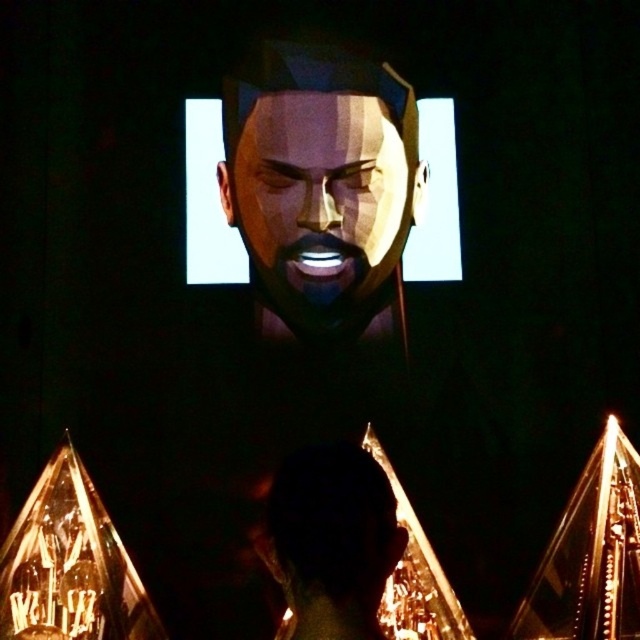
Measure the distance between matte metallic face at center and black matte head at center.

matte metallic face at center is 17.02 feet from black matte head at center.

Between point (364, 125) and point (326, 611), which one is positioned in front?

Point (326, 611) is in front.

Where is `matte metallic face at center`? The height and width of the screenshot is (640, 640). matte metallic face at center is located at coordinates (317, 196).

Identify the location of matte metallic face at center. (317, 196).